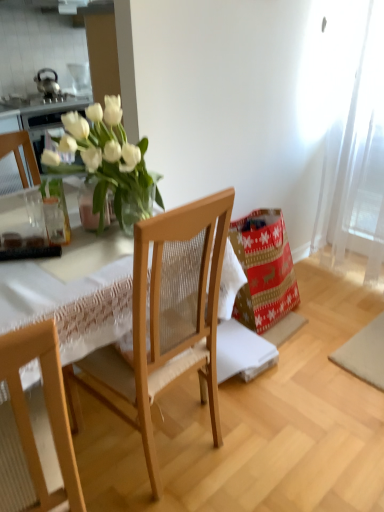
Locate an element on the screen. empty space that is to the right of red and gold paper bag at lower right is located at coordinates (338, 316).